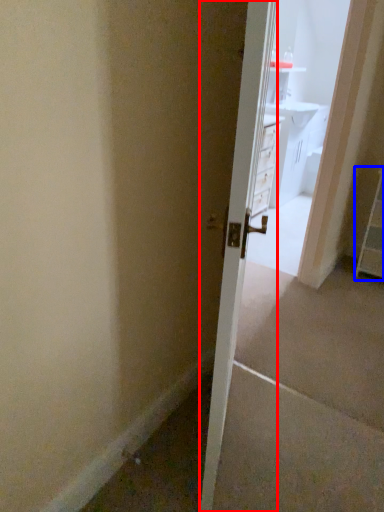
Question: Which object is closer to the camera taking this photo, door (highlighted by a red box) or dresser (highlighted by a blue box)?

Choices:
 (A) door
 (B) dresser

Answer: (A)